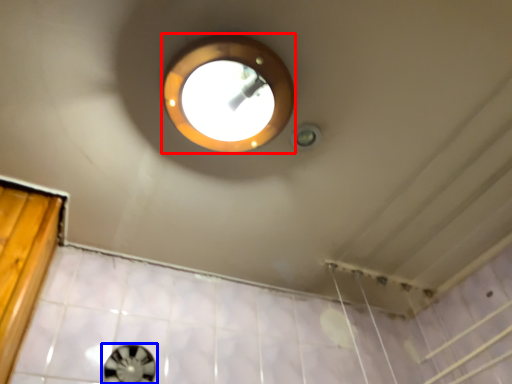
Question: Which of the following is the closest to the observer, light (highlighted by a red box) or porthole (highlighted by a blue box)?

Choices:
 (A) light
 (B) porthole

Answer: (A)